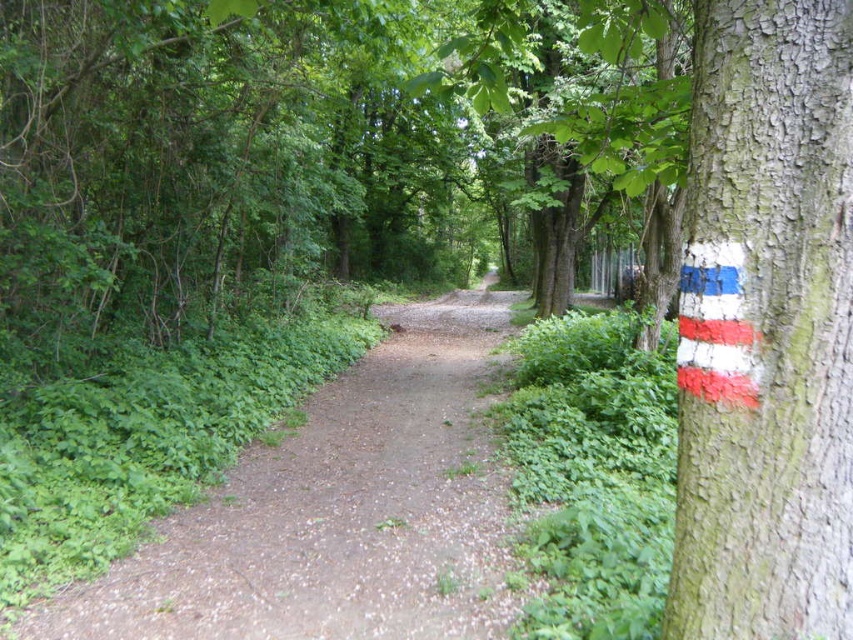
You are standing at the point with coordinates point (318,595) and want to walk to the point with coordinates point (784,112). Which direction should you move to reach your destination?

You should move forward because point (784,112) is in front of point (318,595).

You are a hiker walking along the dirt path at center. You want to take a photo of the smooth bark tree at right. Should you step onto the path or stay off it to get a better angle?

The smooth bark tree at right is positioned over the dirt path at center, so stepping onto the path would allow you to position yourself directly under the tree for a better angle.

You are a hiker who wants to take a photo of both the smooth bark tree at right and the dirt path at center. Since you only have one shot, you need to know which one is closer to you. Which object is nearer to your current position?

The smooth bark tree at right is closer to the viewer than the dirt path at center, so you should focus on it first to ensure both are in clear view.